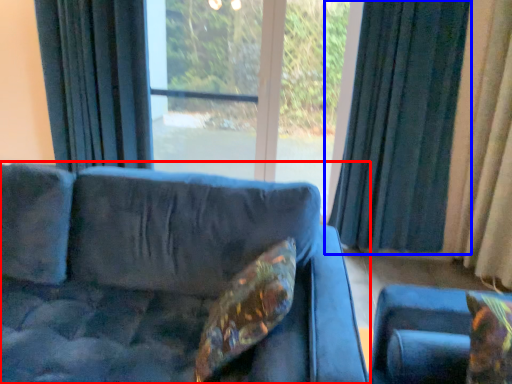
Question: Which object is further to the camera taking this photo, studio couch (highlighted by a red box) or curtain (highlighted by a blue box)?

Choices:
 (A) studio couch
 (B) curtain

Answer: (B)